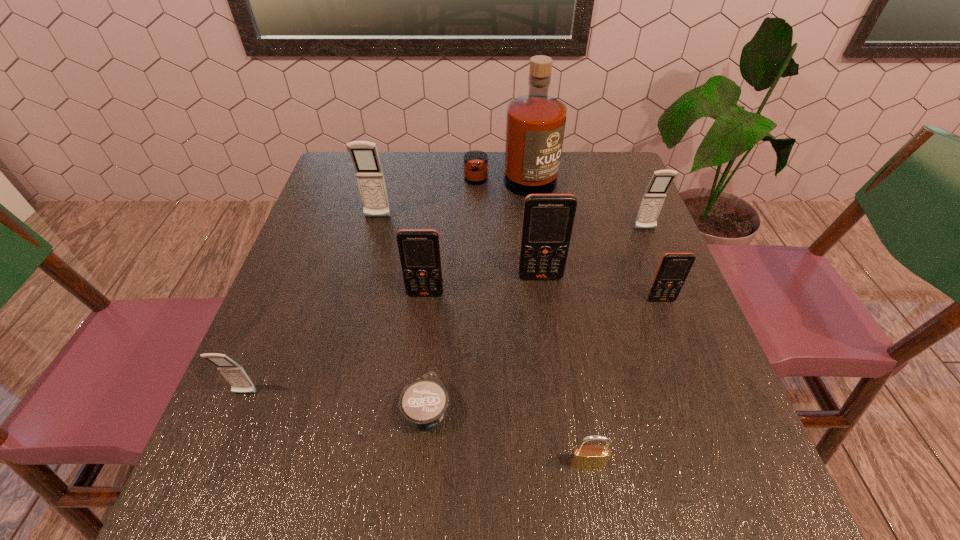
At what (x,y) coordinates should I click in order to perform the action: click on the tallest object. Please return your answer as a coordinate pair (x, y). The width and height of the screenshot is (960, 540). Looking at the image, I should click on tap(535, 123).

At what (x,y) coordinates should I click in order to perform the action: click on liquor. Please return your answer as a coordinate pair (x, y). Image resolution: width=960 pixels, height=540 pixels. Looking at the image, I should click on (535, 123).

Image resolution: width=960 pixels, height=540 pixels. I want to click on the farthest gray cellular telephone, so click(364, 154).

The height and width of the screenshot is (540, 960). Find the location of `the second gray cellular telephone from left to right`. the second gray cellular telephone from left to right is located at coordinates pos(364,154).

Locate an element on the screen. the third farthest cellular telephone is located at coordinates (548, 219).

Find the location of `the farthest orange cellular telephone`. the farthest orange cellular telephone is located at coordinates (548, 219).

Where is `the second nearest gray cellular telephone`? the second nearest gray cellular telephone is located at coordinates (655, 193).

Image resolution: width=960 pixels, height=540 pixels. I want to click on the seventh nearest object, so click(x=655, y=193).

At what (x,y) coordinates should I click in order to perform the action: click on the second biggest orange cellular telephone. Please return your answer as a coordinate pair (x, y). This screenshot has width=960, height=540. Looking at the image, I should click on (419, 249).

Find the location of a particular element. This screenshot has width=960, height=540. the leftmost orange cellular telephone is located at coordinates (419, 249).